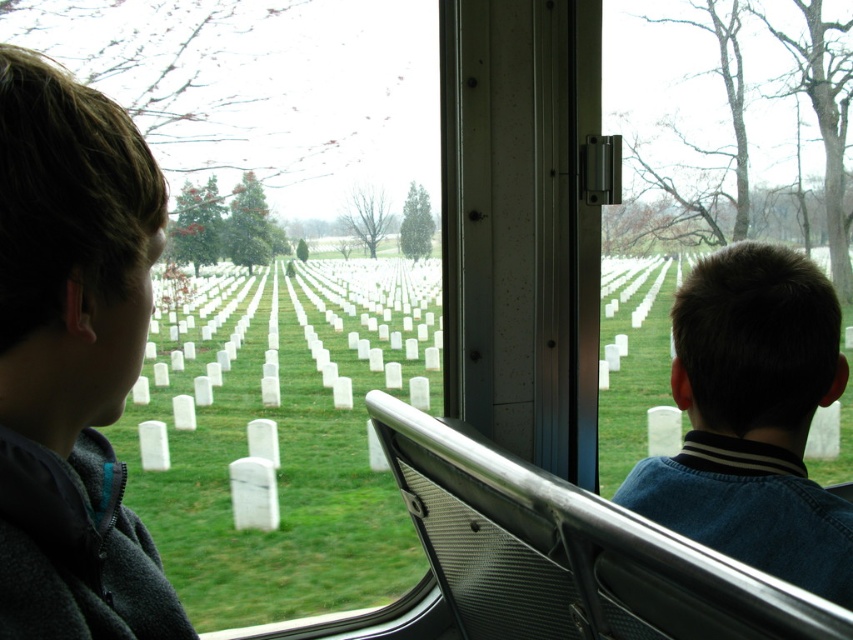
You are a photographer standing in the vehicle and want to take a closeup photo of the dark blue sweater at center. The camera you are using has a minimum focusing distance of 30 inches. Can you take the photo without moving closer?

The dark blue sweater at center is 29.73 inches away from camera. Since the minimum focusing distance is 30 inches, the camera cannot focus on the sweater at this distance. You need to move slightly further away or use a different camera with a shorter minimum focusing distance.

You are a passenger in the vehicle and want to know how far the point at coordinates (737, 493) is from the camera. Can you determine the distance?

The point at coordinates (737, 493) is 1.04 meters away from the camera.

Looking at this image, you are a passenger in the vehicle and want to describe the people sitting inside. Which of the two objects, the dark brown hair at left or the dark blue sweater at center, appears narrower?

The dark brown hair at left appears narrower than the dark blue sweater at center because it has a lesser width compared to it.